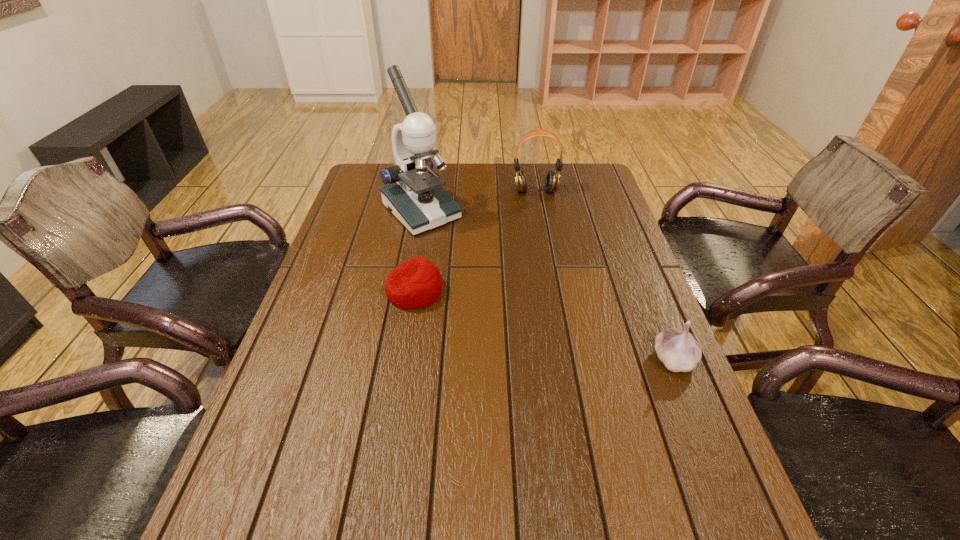
Find the location of `vacant space on the desktop that is between the second nearest object and the nearest object and is positioned at the eyepiece of the tallest object`. vacant space on the desktop that is between the second nearest object and the nearest object and is positioned at the eyepiece of the tallest object is located at coordinates (537, 323).

The height and width of the screenshot is (540, 960). I want to click on free space on the desktop that is between the shortest object and the third tallest object and is positioned on the ear cups of the headset, so click(560, 329).